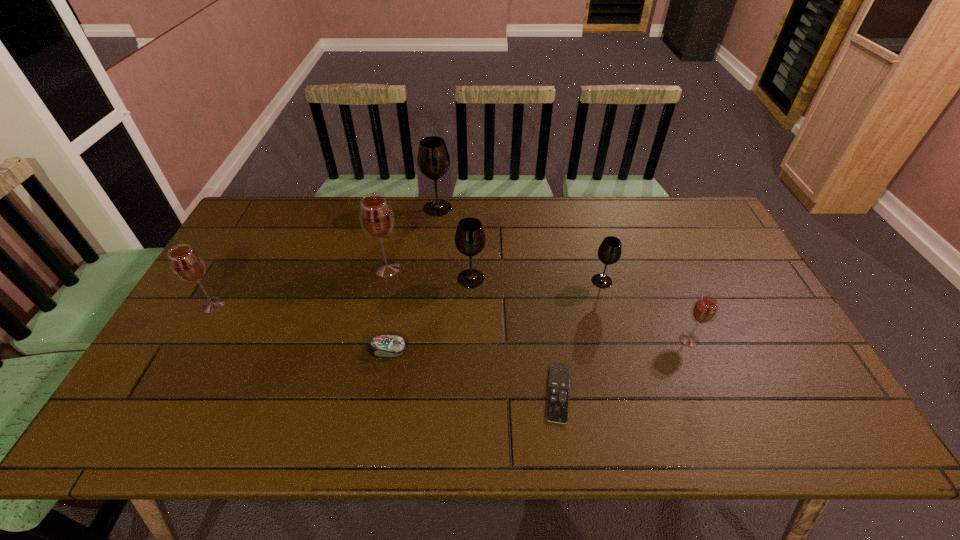
You are a GUI agent. You are given a task and a screenshot of the screen. Output one action in this format:
    pyautogui.click(x=<x>, y=<y>)
    Task: Click on the vacant space located on the left of the second object from right to left
    The width and height of the screenshot is (960, 540).
    Given the screenshot: What is the action you would take?
    pyautogui.click(x=507, y=281)

At what (x,y) coordinates should I click in order to perform the action: click on free space located 0.310m on the wheel side of the seventh tallest object. Please return your answer as a coordinate pair (x, y). Image resolution: width=960 pixels, height=540 pixels. Looking at the image, I should click on (527, 349).

This screenshot has width=960, height=540. I want to click on free location located on the left of the third object from right to left, so click(412, 393).

Where is `object located at the far edge`? The width and height of the screenshot is (960, 540). object located at the far edge is located at coordinates (433, 159).

Find the location of a particular element. Image resolution: width=960 pixels, height=540 pixels. object at the near edge is located at coordinates (558, 389).

At what (x,y) coordinates should I click in order to perform the action: click on object situated at the left edge. Please return your answer as a coordinate pair (x, y). The width and height of the screenshot is (960, 540). Looking at the image, I should click on [187, 264].

The width and height of the screenshot is (960, 540). What are the coordinates of `free space at the far edge of the desktop` in the screenshot? It's located at (559, 222).

You are a GUI agent. You are given a task and a screenshot of the screen. Output one action in this format:
    pyautogui.click(x=<x>, y=<y>)
    Task: Click on the vacant point at the near edge
    
    Given the screenshot: What is the action you would take?
    pyautogui.click(x=386, y=444)

In the image, there is a desktop. Where is `vacant space at the left edge`? vacant space at the left edge is located at coordinates coord(186,394).

The width and height of the screenshot is (960, 540). In order to click on vacant space at the right edge of the desktop in this screenshot , I will do [732, 251].